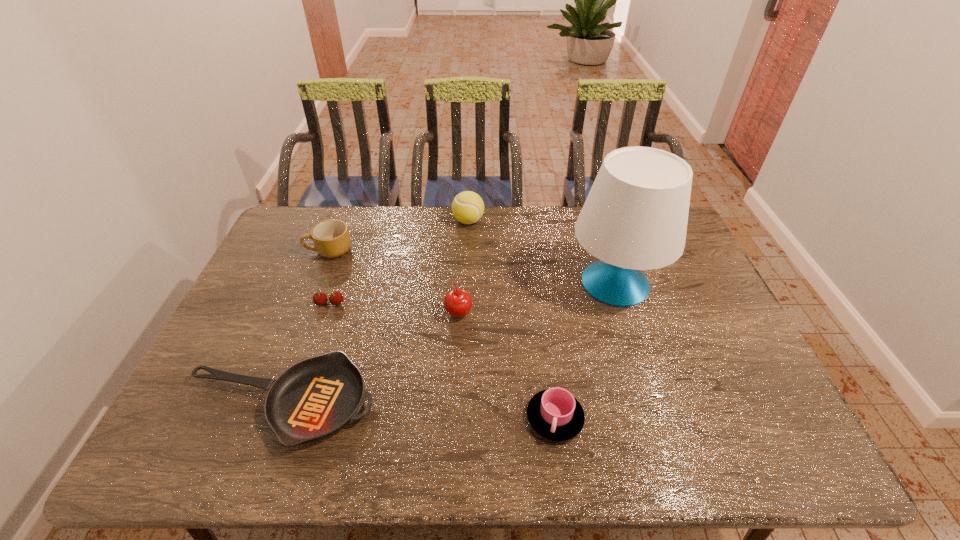
Where is `free space at the right edge of the desktop`? The image size is (960, 540). free space at the right edge of the desktop is located at coordinates tap(684, 346).

Find the location of a particular element. blank space at the far left corner is located at coordinates (285, 242).

You are a GUI agent. You are given a task and a screenshot of the screen. Output one action in this format:
    pyautogui.click(x=<x>, y=<y>)
    Task: Click on the blank area at the near left corner
    The height and width of the screenshot is (540, 960).
    Given the screenshot: What is the action you would take?
    (x=200, y=441)

Locate an element on the screen. Image resolution: width=960 pixels, height=540 pixels. vacant area that lies between the rightmost object and the second object from right to left is located at coordinates (585, 350).

Where is `empty space between the left cherry and the right cherry`? The height and width of the screenshot is (540, 960). empty space between the left cherry and the right cherry is located at coordinates (395, 308).

This screenshot has width=960, height=540. What are the coordinates of `free area in between the rightmost object and the cup` in the screenshot? It's located at click(x=585, y=350).

Image resolution: width=960 pixels, height=540 pixels. I want to click on empty space between the third shortest object and the table lamp, so click(472, 267).

The width and height of the screenshot is (960, 540). In order to click on vacant space that is in between the left cherry and the farthest object in this screenshot , I will do 399,262.

The width and height of the screenshot is (960, 540). Identify the location of blank region between the left cherry and the tennis ball. (399, 262).

What are the coordinates of `vacant region between the rightmost object and the right cherry` in the screenshot? It's located at (537, 298).